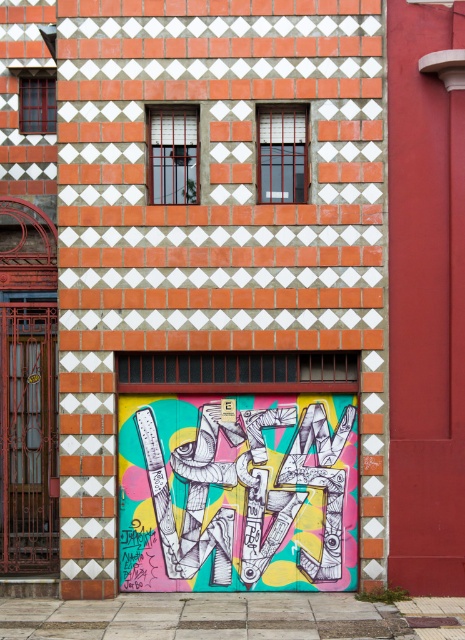
You are an artist planning to add a new piece to the building facade. You have a painting that is 2 meters tall. The building has the colorful graffiti at center and the metallic painted garage door at lower left. Which of these two areas can accommodate your painting based on their heights?

The metallic painted garage door at lower left is taller than the colorful graffiti at center. Since your painting is 2 meters tall, you should check the height of each area. If the garage door is taller, it might be suitable, but the graffiti area may be too short. However, the exact dimensions aren

Consider the image. You are an artist planning to paint a new mural on the building facade. You want to ensure your design fits within the space currently occupied by the metallic painted garage door at lower left. Given the dimensions provided, will the colorful graffiti at center fit in that space?

The colorful graffiti at center is wider than the metallic painted garage door at lower left, so it won not fit within the space of the metallic painted garage door at lower left.

You are a delivery person trying to locate the entrance to the building. The entrance is on the side of the metallic painted garage door at lower left that is closest to the colorful graffiti at center. Which direction should you go relative to the garage door?

The entrance is on the right side of the metallic painted garage door at lower left because the colorful graffiti at center is positioned to its right. Therefore, you should go towards the right side of the garage door to find the entrance.